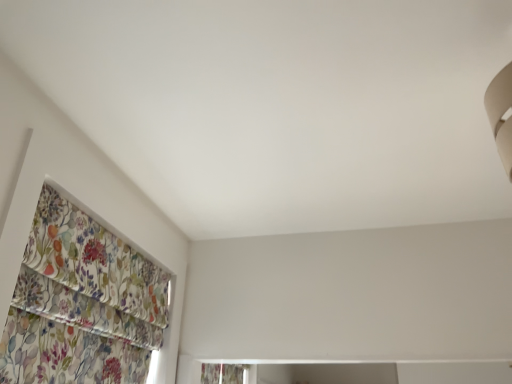
Describe the element at coordinates (90, 277) in the screenshot. This screenshot has height=384, width=512. I see `floral fabric curtain at left` at that location.

You are a GUI agent. You are given a task and a screenshot of the screen. Output one action in this format:
    pyautogui.click(x=<x>, y=<y>)
    Task: Click on the floral fabric curtain at left
    The image size is (512, 384).
    Given the screenshot: What is the action you would take?
    pyautogui.click(x=90, y=277)

Consider the image. Measure the distance between point (82, 326) and camera.

The depth of point (82, 326) is 4.63 feet.

The width and height of the screenshot is (512, 384). I want to click on floral fabric curtain at left, so click(90, 277).